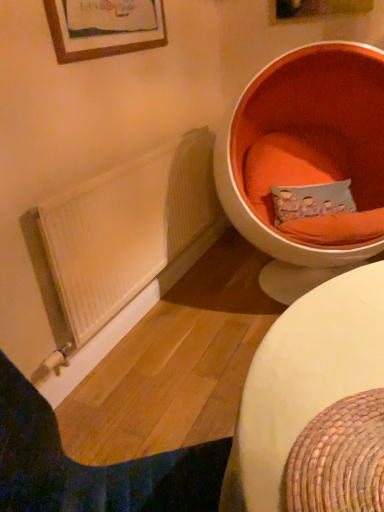
Question: Does orange fabric at right contain white woven table at lower right?

Choices:
 (A) yes
 (B) no

Answer: (B)

Question: Does orange fabric at right appear on the left side of white woven table at lower right?

Choices:
 (A) no
 (B) yes

Answer: (A)

Question: From the image's perspective, is orange fabric at right below white woven table at lower right?

Choices:
 (A) yes
 (B) no

Answer: (B)

Question: Is orange fabric at right smaller than white woven table at lower right?

Choices:
 (A) yes
 (B) no

Answer: (B)

Question: From the image's perspective, is orange fabric at right on white woven table at lower right?

Choices:
 (A) no
 (B) yes

Answer: (B)

Question: Is orange fabric at right positioned before white woven table at lower right?

Choices:
 (A) yes
 (B) no

Answer: (B)

Question: Is the surface of white wood radiator at lower left in direct contact with orange fabric at right?

Choices:
 (A) no
 (B) yes

Answer: (A)

Question: Is white wood radiator at lower left closer to the viewer compared to orange fabric at right?

Choices:
 (A) yes
 (B) no

Answer: (A)

Question: Is orange fabric at right inside white wood radiator at lower left?

Choices:
 (A) yes
 (B) no

Answer: (B)

Question: Can you confirm if white wood radiator at lower left is thinner than orange fabric at right?

Choices:
 (A) yes
 (B) no

Answer: (A)

Question: From the image's perspective, does white wood radiator at lower left appear lower than orange fabric at right?

Choices:
 (A) no
 (B) yes

Answer: (B)

Question: From a real-world perspective, is white wood radiator at lower left beneath orange fabric at right?

Choices:
 (A) yes
 (B) no

Answer: (A)

Question: From the image's perspective, is orange fabric pillow at upper right located beneath white woven table at lower right?

Choices:
 (A) no
 (B) yes

Answer: (A)